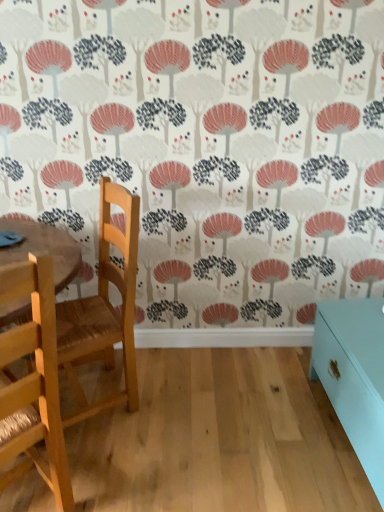
Find the location of a particular element. teal glossy cabinet at lower right is located at coordinates (354, 376).

Describe the element at coordinates (354, 376) in the screenshot. I see `teal glossy cabinet at lower right` at that location.

Locate an element on the screen. The height and width of the screenshot is (512, 384). wooden chair at left, which is counted as the first chair, starting from the back is located at coordinates (104, 309).

At what (x,y) coordinates should I click in order to perform the action: click on teal glossy cabinet at lower right. Please return your answer as a coordinate pair (x, y). Looking at the image, I should click on (354, 376).

Can you confirm if teal glossy cabinet at lower right is thinner than wooden chair at left, which appears as the second chair when viewed from the front?

Indeed, teal glossy cabinet at lower right has a lesser width compared to wooden chair at left, which appears as the second chair when viewed from the front.

Is teal glossy cabinet at lower right bigger than wooden chair at left, which is counted as the first chair, starting from the back?

Actually, teal glossy cabinet at lower right might be smaller than wooden chair at left, which is counted as the first chair, starting from the back.

Is teal glossy cabinet at lower right surrounding wooden chair at left, which is counted as the first chair, starting from the back?

No.

From the image's perspective, between teal glossy cabinet at lower right and wooden chair at left, which appears as the second chair when viewed from the front, who is located below?

teal glossy cabinet at lower right is shown below in the image.

You are a GUI agent. You are given a task and a screenshot of the screen. Output one action in this format:
    pyautogui.click(x=<x>, y=<y>)
    Task: Click on the chair that is below the wooden chair at left, which is counted as the first chair, starting from the back (from the image's perspective)
    The image size is (384, 512).
    Given the screenshot: What is the action you would take?
    pyautogui.click(x=33, y=383)

Based on the photo, is light wood chair at left, the second chair positioned from the back, beside wooden chair at left, which is counted as the first chair, starting from the back?

light wood chair at left, the second chair positioned from the back, and wooden chair at left, which is counted as the first chair, starting from the back, are clearly separated.

From a real-world perspective, between light wood chair at left, arranged as the 1th chair when viewed from the front, and wooden chair at left, which is counted as the first chair, starting from the back, who is vertically higher?

In real-world perspective, wooden chair at left, which is counted as the first chair, starting from the back, is above.

From a real-world perspective, which is physically below, wooden chair at left, which appears as the second chair when viewed from the front, or teal glossy cabinet at lower right?

teal glossy cabinet at lower right, from a real-world perspective.

From the image's perspective, which one is positioned lower, wooden chair at left, which is counted as the first chair, starting from the back, or teal glossy cabinet at lower right?

teal glossy cabinet at lower right, from the image's perspective.

Locate an element on the screen. This screenshot has height=512, width=384. table located in front of the wooden chair at left, which appears as the second chair when viewed from the front is located at coordinates (354, 376).

What's the angular difference between wooden chair at left, which appears as the second chair when viewed from the front, and light wood chair at left, the second chair positioned from the back,'s facing directions?

71.3 degrees separate the facing orientations of wooden chair at left, which appears as the second chair when viewed from the front, and light wood chair at left, the second chair positioned from the back.

Considering the sizes of objects wooden chair at left, which appears as the second chair when viewed from the front, and light wood chair at left, the second chair positioned from the back, in the image provided, who is smaller, wooden chair at left, which appears as the second chair when viewed from the front, or light wood chair at left, the second chair positioned from the back,?

Smaller between the two is light wood chair at left, the second chair positioned from the back.

From a real-world perspective, relative to light wood chair at left, arranged as the 1th chair when viewed from the front, is wooden chair at left, which is counted as the first chair, starting from the back, vertically above or below?

In terms of real-world spatial position, wooden chair at left, which is counted as the first chair, starting from the back, is above light wood chair at left, arranged as the 1th chair when viewed from the front.

Which object is closer to the camera, wooden chair at left, which appears as the second chair when viewed from the front, or light wood chair at left, arranged as the 1th chair when viewed from the front?

light wood chair at left, arranged as the 1th chair when viewed from the front.

What are the coordinates of `the 1st chair positioned above the teal glossy cabinet at lower right (from the image's perspective)` in the screenshot? It's located at (33, 383).

Which of these two, teal glossy cabinet at lower right or light wood chair at left, the second chair positioned from the back, is smaller?

light wood chair at left, the second chair positioned from the back, is smaller.

Considering the positions of objects teal glossy cabinet at lower right and light wood chair at left, the second chair positioned from the back, in the image provided, who is more to the left, teal glossy cabinet at lower right or light wood chair at left, the second chair positioned from the back,?

light wood chair at left, the second chair positioned from the back, is more to the left.

Is light wood chair at left, the second chair positioned from the back, far away from teal glossy cabinet at lower right?

Indeed, light wood chair at left, the second chair positioned from the back, is not near teal glossy cabinet at lower right.

Considering the sizes of light wood chair at left, arranged as the 1th chair when viewed from the front, and teal glossy cabinet at lower right in the image, is light wood chair at left, arranged as the 1th chair when viewed from the front, wider or thinner than teal glossy cabinet at lower right?

light wood chair at left, arranged as the 1th chair when viewed from the front, is wider than teal glossy cabinet at lower right.

From a real-world perspective, is light wood chair at left, arranged as the 1th chair when viewed from the front, positioned under teal glossy cabinet at lower right based on gravity?

Actually, light wood chair at left, arranged as the 1th chair when viewed from the front, is physically above teal glossy cabinet at lower right in the real world.

Would you say light wood chair at left, the second chair positioned from the back, is to the left or to the right of teal glossy cabinet at lower right in the picture?

From the image, it's evident that light wood chair at left, the second chair positioned from the back, is to the left of teal glossy cabinet at lower right.

You are a GUI agent. You are given a task and a screenshot of the screen. Output one action in this format:
    pyautogui.click(x=<x>, y=<y>)
    Task: Click on the table in front of the wooden chair at left, which appears as the second chair when viewed from the front
    The width and height of the screenshot is (384, 512).
    Given the screenshot: What is the action you would take?
    pyautogui.click(x=354, y=376)

The height and width of the screenshot is (512, 384). I want to click on chair above the light wood chair at left, the second chair positioned from the back (from the image's perspective), so click(x=104, y=309).

Based on their spatial positions, is wooden chair at left, which appears as the second chair when viewed from the front, or teal glossy cabinet at lower right further from light wood chair at left, arranged as the 1th chair when viewed from the front?

teal glossy cabinet at lower right.

Considering their positions, is light wood chair at left, the second chair positioned from the back, positioned further to wooden chair at left, which is counted as the first chair, starting from the back, than teal glossy cabinet at lower right?

teal glossy cabinet at lower right.

Based on their spatial positions, is light wood chair at left, arranged as the 1th chair when viewed from the front, or wooden chair at left, which is counted as the first chair, starting from the back, further from teal glossy cabinet at lower right?

light wood chair at left, arranged as the 1th chair when viewed from the front.

Looking at the image, which one is located closer to light wood chair at left, arranged as the 1th chair when viewed from the front, teal glossy cabinet at lower right or wooden chair at left, which is counted as the first chair, starting from the back?

wooden chair at left, which is counted as the first chair, starting from the back, is positioned closer to the anchor light wood chair at left, arranged as the 1th chair when viewed from the front.

Based on their spatial positions, is teal glossy cabinet at lower right or light wood chair at left, the second chair positioned from the back, further from wooden chair at left, which is counted as the first chair, starting from the back?

teal glossy cabinet at lower right is positioned further to the anchor wooden chair at left, which is counted as the first chair, starting from the back.

When comparing their distances from teal glossy cabinet at lower right, does wooden chair at left, which appears as the second chair when viewed from the front, or light wood chair at left, the second chair positioned from the back, seem further?

Among the two, light wood chair at left, the second chair positioned from the back, is located further to teal glossy cabinet at lower right.

This screenshot has width=384, height=512. I want to click on chair between light wood chair at left, arranged as the 1th chair when viewed from the front, and teal glossy cabinet at lower right from left to right, so click(x=104, y=309).